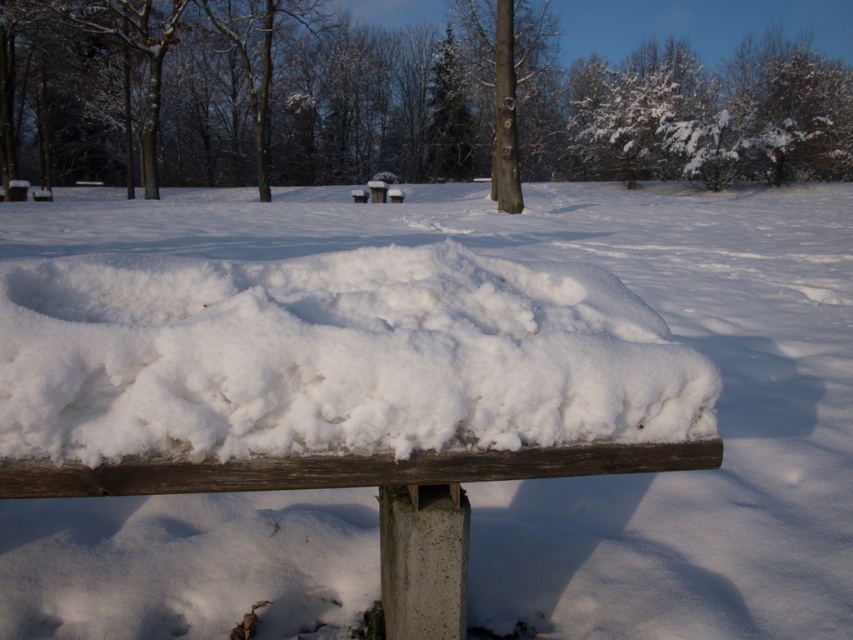
You are standing in the winter scene and want to place a small snowman between the two points, point [647,348] and point [515,8]. Which point should the snowman be closer to in order to appear larger in the image?

The snowman should be placed closer to point [647,348] because objects closer to the camera appear larger in the image.